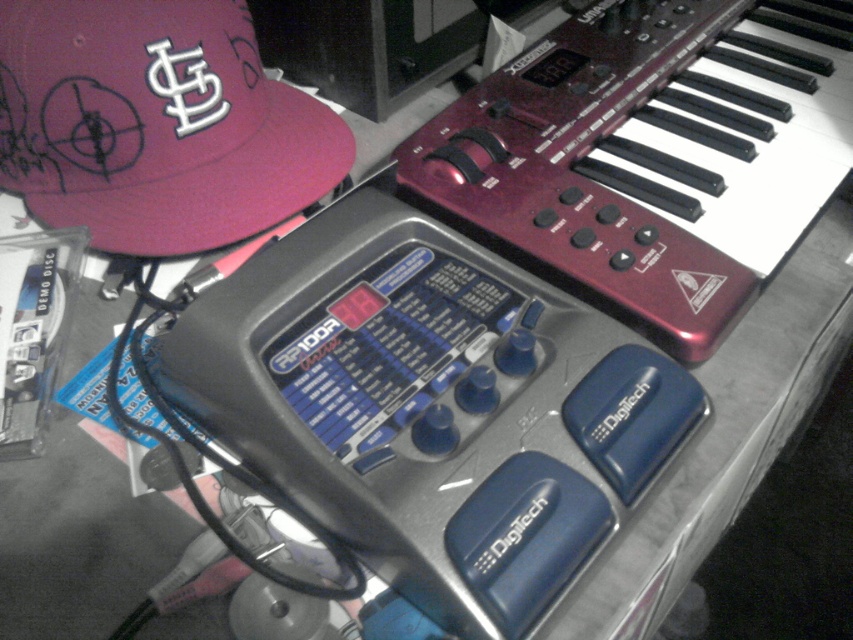
You are setting up a music studio and need to place a matte pink cap at upper left and a metallic red keyboard at upper right. According to the image, where should you position the metallic red keyboard relative to the matte pink cap?

The metallic red keyboard at upper right is located above the matte pink cap at upper left, so you should position the metallic red keyboard above the matte pink cap.

Consider the image. You are setting up a music studio and need to place the metallic red keyboard at upper right and the matte pink cap at upper left on a shelf. Based on their widths, which one should you place first to ensure they both fit?

The metallic red keyboard at upper right might be wider than matte pink cap at upper left, so you should place the wider one first to ensure both fit on the shelf.